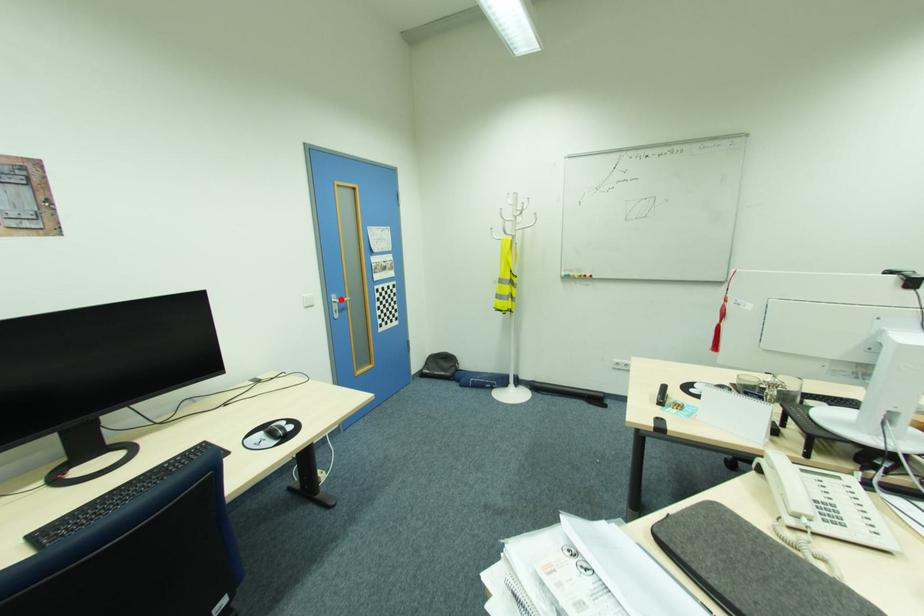
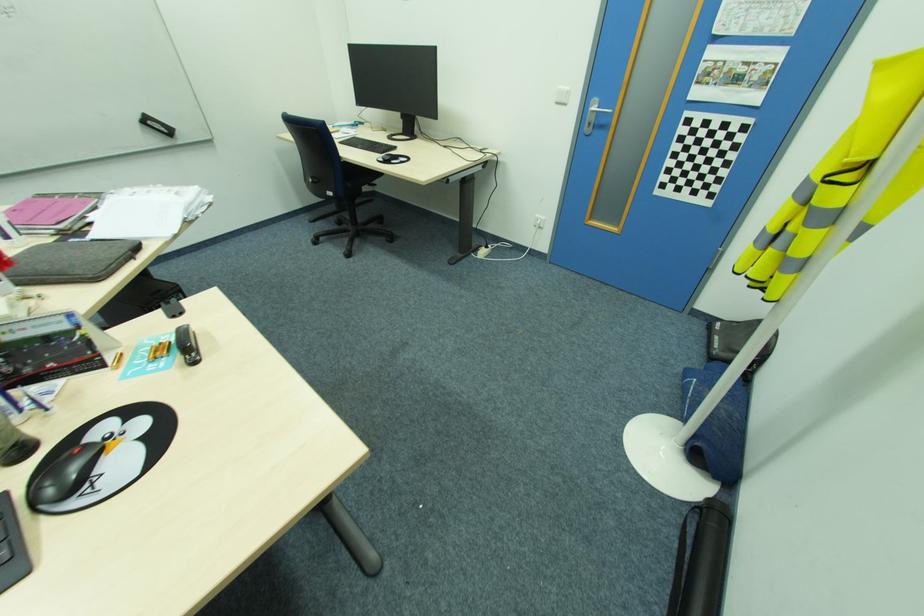
Locate, in the second image, the point that corresponds to the highlighted location in the first image.

(600, 108)